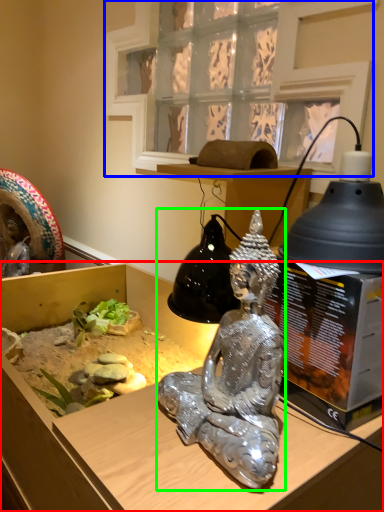
Question: Considering the real-world distances, which object is closest to furniture (highlighted by a red box)? window (highlighted by a blue box) or person (highlighted by a green box).

Choices:
 (A) window
 (B) person

Answer: (B)